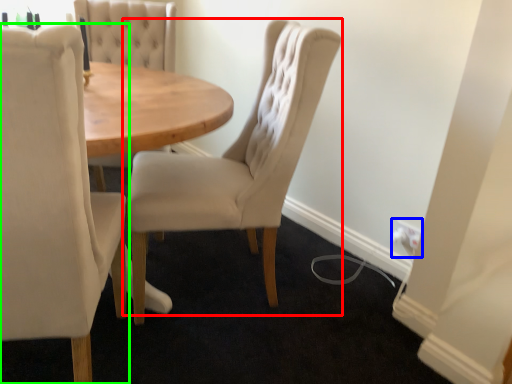
Question: Based on their relative distances, which object is farther from chair (highlighted by a red box)? Choose from electric outlet (highlighted by a blue box) and chair (highlighted by a green box).

Choices:
 (A) electric outlet
 (B) chair

Answer: (A)